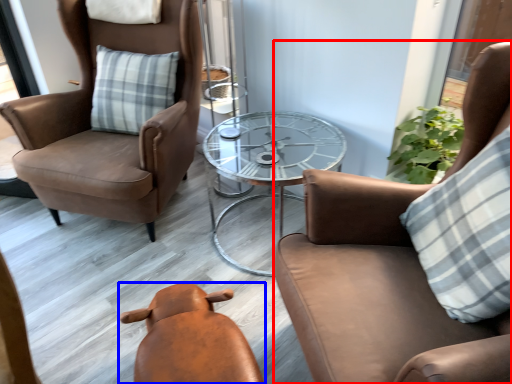
Question: Which of the following is the farthest to the observer, chair (highlighted by a red box) or chair (highlighted by a blue box)?

Choices:
 (A) chair
 (B) chair

Answer: (B)